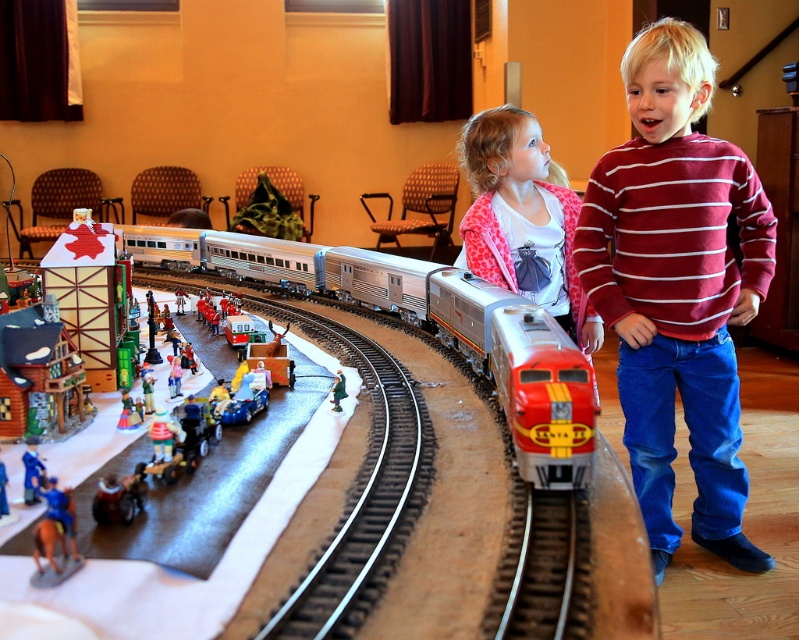
Between point (116, 248) and point (42, 417), which one is positioned behind?

Positioned behind is point (116, 248).

Based on the photo, between barn wood building at left and wooden house at left, which one appears on the right side from the viewer's perspective?

wooden house at left

Who is more forward, (108,300) or (14,353)?

Positioned in front is point (14,353).

You are a GUI agent. You are given a task and a screenshot of the screen. Output one action in this format:
    pyautogui.click(x=<x>, y=<y>)
    Task: Click on the barn wood building at left
    
    Given the screenshot: What is the action you would take?
    pyautogui.click(x=90, y=292)

Can you confirm if metallic silver train at center is wider than wooden house at left?

Yes.

What do you see at coordinates (344, 278) in the screenshot?
I see `metallic silver train at center` at bounding box center [344, 278].

Between point (396, 312) and point (46, 337), which one is positioned in front?

Positioned in front is point (46, 337).

Find the location of a particular element. The height and width of the screenshot is (640, 799). metallic silver train at center is located at coordinates (344, 278).

Does brown wooden train track at lower center have a smaller size compared to wooden house at left?

Yes.

Does brown wooden train track at lower center lie behind wooden house at left?

No, it is not.

Image resolution: width=799 pixels, height=640 pixels. What are the coordinates of `brown wooden train track at lower center` in the screenshot? It's located at (543, 570).

In order to click on brown wooden train track at lower center in this screenshot , I will do `click(543, 570)`.